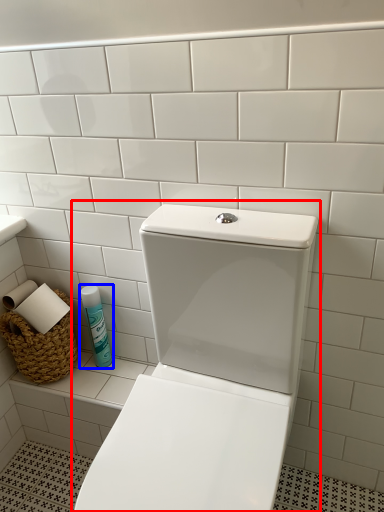
Question: Which object is further to the camera taking this photo, toilet (highlighted by a red box) or cleaning product (highlighted by a blue box)?

Choices:
 (A) toilet
 (B) cleaning product

Answer: (B)